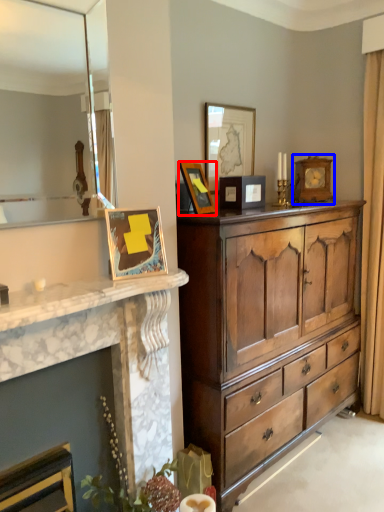
Question: Which point is closer to the camera, picture frame (highlighted by a red box) or picture frame (highlighted by a blue box)?

Choices:
 (A) picture frame
 (B) picture frame

Answer: (A)